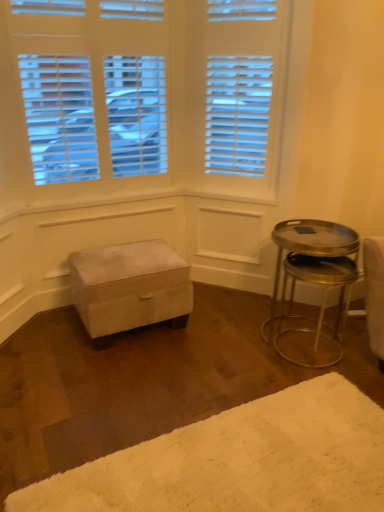
Question: From the image's perspective, is white fluffy rug at lower right over velvet ottoman at center?

Choices:
 (A) yes
 (B) no

Answer: (B)

Question: Is white fluffy rug at lower right aimed at velvet ottoman at center?

Choices:
 (A) yes
 (B) no

Answer: (B)

Question: Can you confirm if white fluffy rug at lower right is bigger than velvet ottoman at center?

Choices:
 (A) no
 (B) yes

Answer: (A)

Question: Considering the relative sizes of white fluffy rug at lower right and velvet ottoman at center in the image provided, is white fluffy rug at lower right shorter than velvet ottoman at center?

Choices:
 (A) yes
 (B) no

Answer: (A)

Question: Does white fluffy rug at lower right have a greater height compared to velvet ottoman at center?

Choices:
 (A) no
 (B) yes

Answer: (A)

Question: Is white fluffy rug at lower right far from velvet ottoman at center?

Choices:
 (A) yes
 (B) no

Answer: (B)

Question: Is velvet ottoman at center facing towards metallic silver table at right?

Choices:
 (A) yes
 (B) no

Answer: (B)

Question: Is velvet ottoman at center at the right side of metallic silver table at right?

Choices:
 (A) no
 (B) yes

Answer: (A)

Question: Can you confirm if velvet ottoman at center is wider than metallic silver table at right?

Choices:
 (A) no
 (B) yes

Answer: (B)

Question: Does velvet ottoman at center have a larger size compared to metallic silver table at right?

Choices:
 (A) no
 (B) yes

Answer: (B)

Question: Is the depth of velvet ottoman at center less than that of metallic silver table at right?

Choices:
 (A) yes
 (B) no

Answer: (B)

Question: From a real-world perspective, is velvet ottoman at center physically below metallic silver table at right?

Choices:
 (A) no
 (B) yes

Answer: (B)

Question: Does white fluffy rug at lower right have a lesser height compared to metallic silver table at right?

Choices:
 (A) no
 (B) yes

Answer: (B)